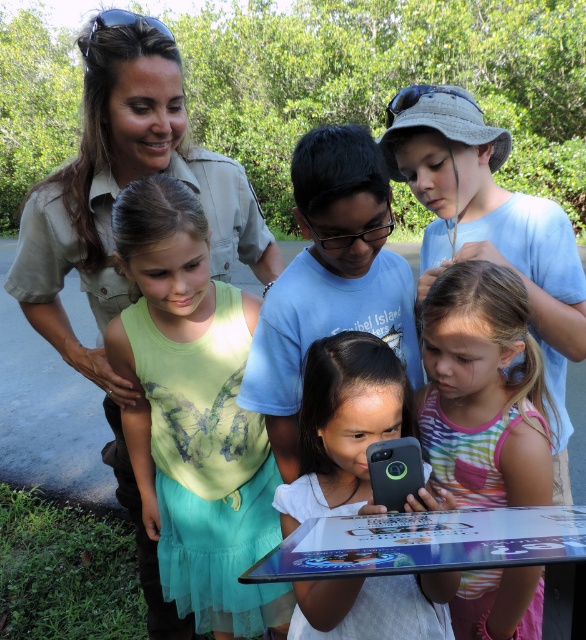
Can you confirm if matte khaki uniform at upper left is positioned to the left of black matte phone at center?

Indeed, matte khaki uniform at upper left is positioned on the left side of black matte phone at center.

Which of these two, matte khaki uniform at upper left or black matte phone at center, stands shorter?

black matte phone at center

Locate an element on the screen. matte khaki uniform at upper left is located at coordinates (110, 228).

Does green fabric dress at center appear on the left side of matte khaki uniform at upper left?

Incorrect, green fabric dress at center is not on the left side of matte khaki uniform at upper left.

Is green fabric dress at center behind matte khaki uniform at upper left?

No, it is in front of matte khaki uniform at upper left.

Where is `green fabric dress at center`? The image size is (586, 640). green fabric dress at center is located at coordinates (193, 413).

Does green fabric dress at center have a larger size compared to black matte smartphone at center?

Yes, green fabric dress at center is bigger than black matte smartphone at center.

What are the coordinates of `green fabric dress at center` in the screenshot? It's located at coord(193,413).

Does point (263, 592) lie in front of point (390, 442)?

No, (263, 592) is behind (390, 442).

At what (x,y) coordinates should I click in order to perform the action: click on green fabric dress at center. Please return your answer as a coordinate pair (x, y). This screenshot has height=640, width=586. Looking at the image, I should click on (193, 413).